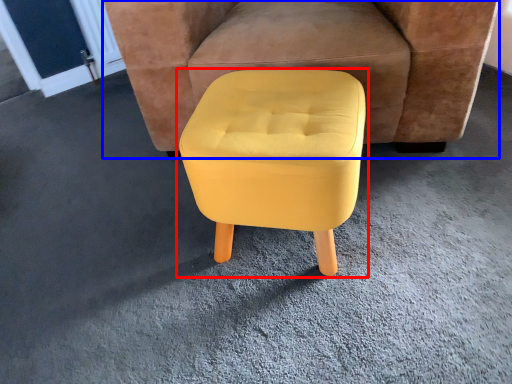
Question: Among these objects, which one is nearest to the camera, stool (highlighted by a red box) or chair (highlighted by a blue box)?

Choices:
 (A) stool
 (B) chair

Answer: (A)